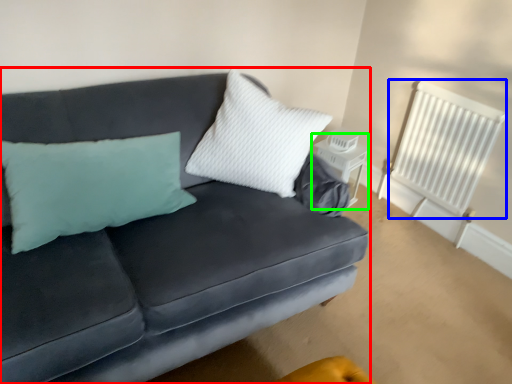
Question: Which object is positioned closest to studio couch (highlighted by a red box)? Select from radiator (highlighted by a blue box) and table (highlighted by a green box).

Choices:
 (A) radiator
 (B) table

Answer: (B)